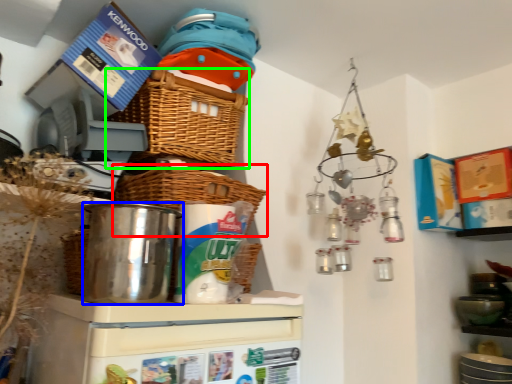
Question: Based on their relative distances, which object is farther from basket (highlighted by a red box)? Choose from appliance (highlighted by a blue box) and basket (highlighted by a green box).

Choices:
 (A) appliance
 (B) basket

Answer: (B)